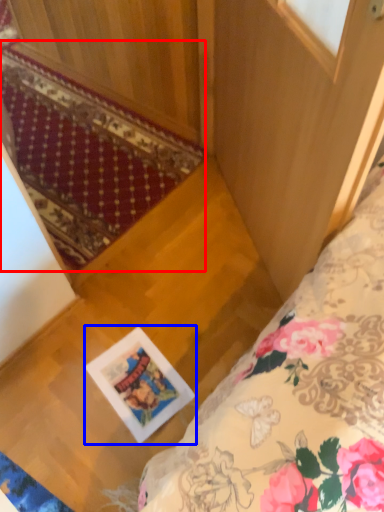
Question: Which object appears closest to the camera in this image, mat (highlighted by a red box) or picture frame (highlighted by a blue box)?

Choices:
 (A) mat
 (B) picture frame

Answer: (A)